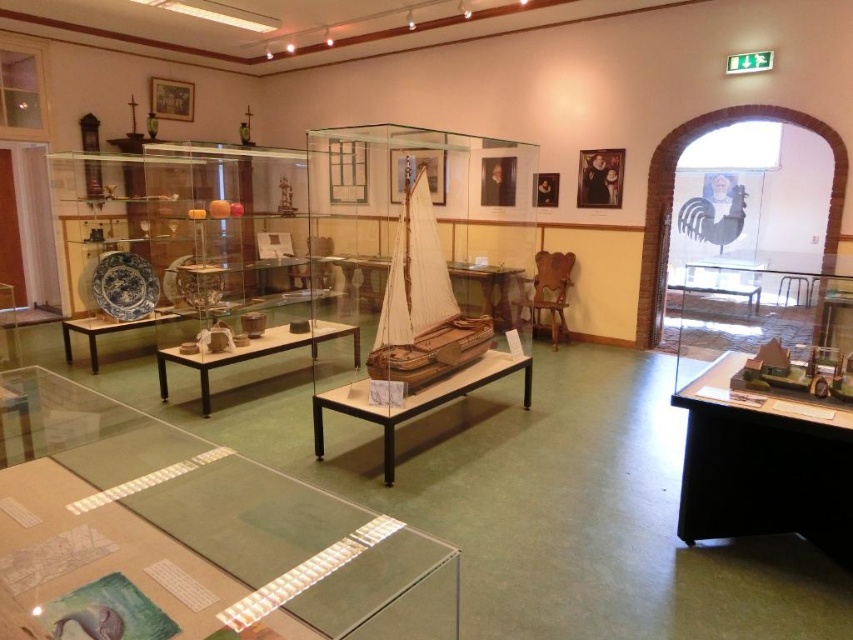
Question: Does wooden sailboat at center have a greater width compared to wooden table at center?

Choices:
 (A) yes
 (B) no

Answer: (B)

Question: Is transparent glass table at lower left in front of wooden boat at center?

Choices:
 (A) no
 (B) yes

Answer: (B)

Question: Which object is farther from the camera taking this photo?

Choices:
 (A) black plastic table at lower right
 (B) wooden boat at center
 (C) matte glass table at center

Answer: (C)

Question: Which point is closer to the camera?

Choices:
 (A) transparent glass table at lower left
 (B) wooden boat at center
 (C) black plastic table at lower right
 (D) matte glass table at center

Answer: (A)

Question: Which object is positioned farthest from the wooden boat at center?

Choices:
 (A) wooden sailboat at center
 (B) wooden table at center

Answer: (B)

Question: Is black plastic table at lower right below wooden boat at center?

Choices:
 (A) no
 (B) yes

Answer: (A)